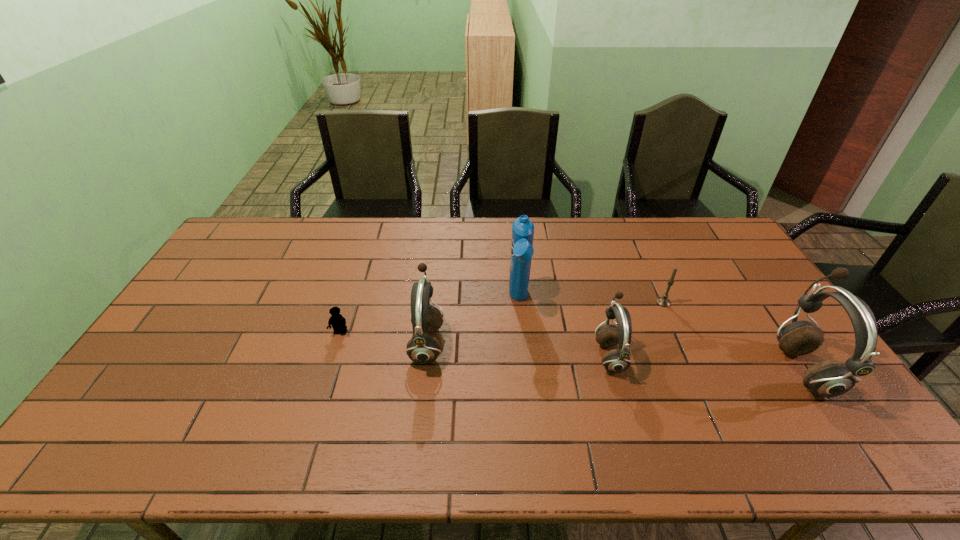
Locate an element on the screen. Image resolution: width=960 pixels, height=540 pixels. the fourth object from right to left is located at coordinates (522, 250).

The width and height of the screenshot is (960, 540). I want to click on vacant space located 0.260m on the ear pads of the fourth shortest object, so click(320, 343).

I want to click on free spot located 0.170m on the ear pads of the fourth shortest object, so click(351, 343).

At what (x,y) coordinates should I click in order to perform the action: click on vacant space located on the ear pads of the fourth shortest object. Please return your answer as a coordinate pair (x, y). Image resolution: width=960 pixels, height=540 pixels. Looking at the image, I should click on (300, 343).

Identify the location of vacant space located 0.290m on the ear pads of the second earphone from left to right. The height and width of the screenshot is (540, 960). (492, 355).

Where is `free space located on the ear pads of the second earphone from left to right`? The image size is (960, 540). free space located on the ear pads of the second earphone from left to right is located at coordinates (478, 355).

Where is `free space located on the ear pads of the second earphone from left to right`? The image size is (960, 540). free space located on the ear pads of the second earphone from left to right is located at coordinates (465, 355).

Identify the location of free location located 0.400m on the ear pads of the rightmost earphone. The height and width of the screenshot is (540, 960). (635, 369).

This screenshot has height=540, width=960. Identify the location of vacant space located 0.320m on the ear pads of the rightmost earphone. (664, 369).

Identify the location of free space located on the ear pads of the rightmost earphone. The width and height of the screenshot is (960, 540). pos(701,369).